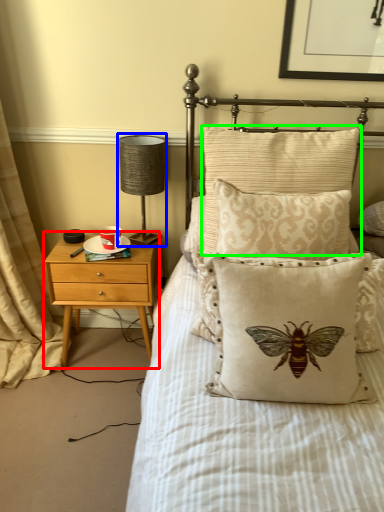
Question: Estimate the real-world distances between objects in this image. Which object is closer to nightstand (highlighted by a red box), table lamp (highlighted by a blue box) or pillow (highlighted by a green box)?

Choices:
 (A) table lamp
 (B) pillow

Answer: (A)